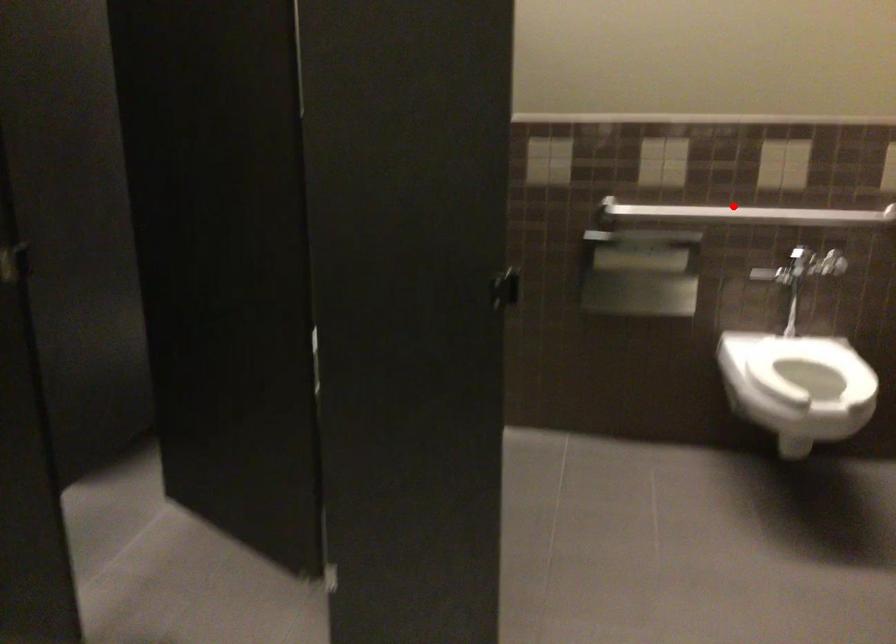
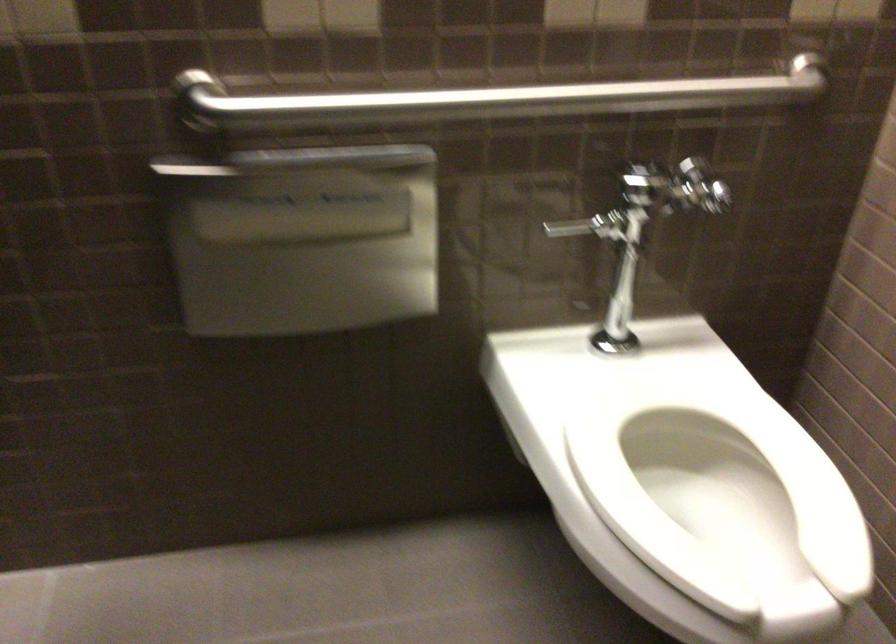
In the second image, find the point that corresponds to the highlighted location in the first image.

(488, 100)